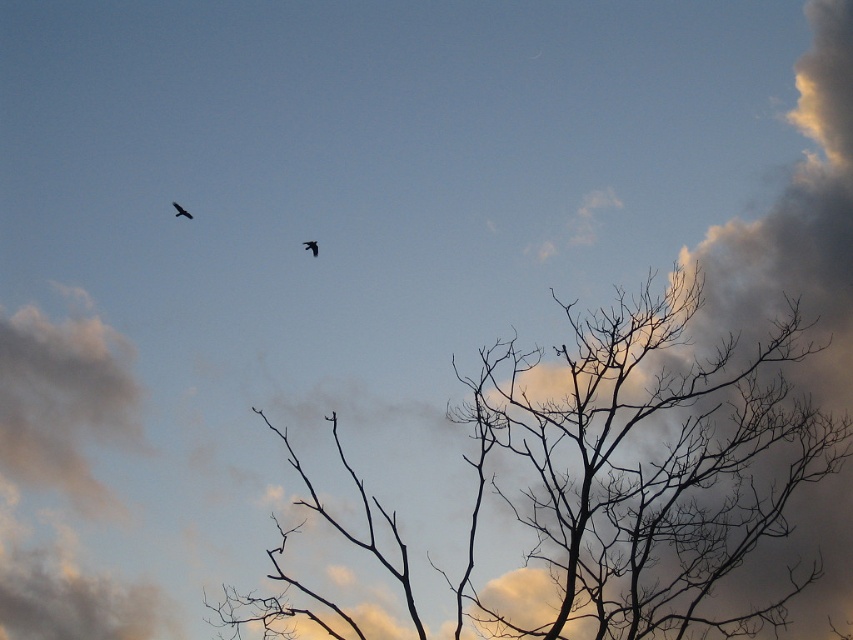
Question: Does silhouette bare branches at center have a smaller size compared to black matte bird at upper left?

Choices:
 (A) no
 (B) yes

Answer: (A)

Question: Is silhouette bare branches at center closer to the viewer compared to black matte bird at upper left?

Choices:
 (A) no
 (B) yes

Answer: (A)

Question: Which of the following is the farthest from the observer?

Choices:
 (A) (329, 416)
 (B) (181, 211)

Answer: (A)

Question: Does black matte bird at upper left appear on the left side of silhouette feathered bird at upper left?

Choices:
 (A) no
 (B) yes

Answer: (B)

Question: Estimate the real-world distances between objects in this image. Which object is closer to the black matte bird at upper left?

Choices:
 (A) silhouette bare branches at center
 (B) silhouette feathered bird at upper left

Answer: (B)

Question: Which is farther from the silhouette bare branches at center?

Choices:
 (A) silhouette feathered bird at upper left
 (B) black matte bird at upper left

Answer: (B)